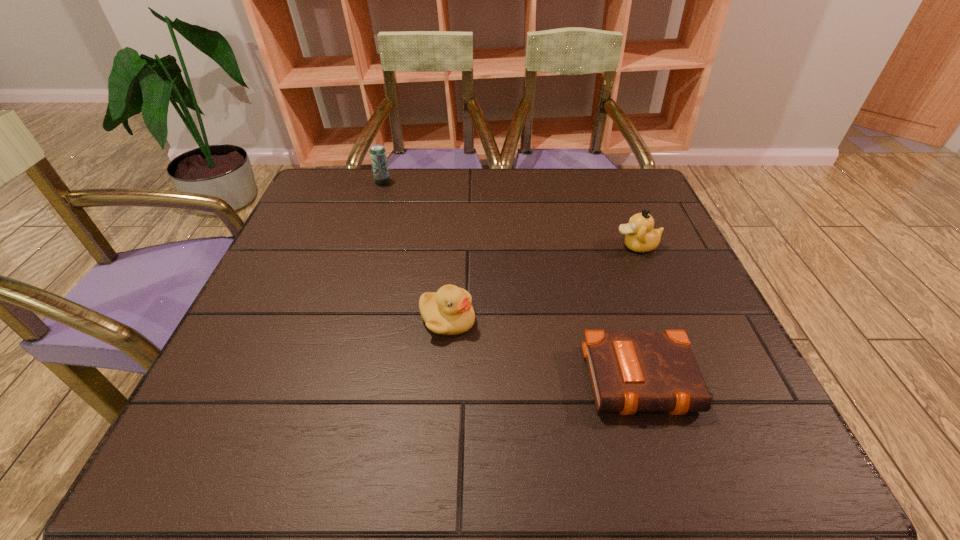
Where is `free region at the left edge`? free region at the left edge is located at coordinates (321, 217).

Where is `blank area at the right edge`? The image size is (960, 540). blank area at the right edge is located at coordinates (688, 307).

This screenshot has height=540, width=960. In the image, there is a desktop. Find the location of `vacant space at the far left corner`. vacant space at the far left corner is located at coordinates (330, 193).

The height and width of the screenshot is (540, 960). Find the location of `vacant space at the near left corner`. vacant space at the near left corner is located at coordinates (279, 434).

Image resolution: width=960 pixels, height=540 pixels. In the image, there is a desktop. Find the location of `blank space at the far right corner`. blank space at the far right corner is located at coordinates (610, 205).

In the image, there is a desktop. At what (x,y) coordinates should I click in order to perform the action: click on blank space at the near right corner. Please return your answer as a coordinate pair (x, y). This screenshot has width=960, height=540. Looking at the image, I should click on (691, 470).

The width and height of the screenshot is (960, 540). Find the location of `empty space that is in between the farthest object and the nearer duckling`. empty space that is in between the farthest object and the nearer duckling is located at coordinates (415, 252).

This screenshot has width=960, height=540. What are the coordinates of `unoccupied position between the beer can and the farther duckling` in the screenshot? It's located at (510, 214).

What are the coordinates of `free space between the second nearest object and the beer can` in the screenshot? It's located at (415, 252).

The height and width of the screenshot is (540, 960). Identify the location of vacant area that lies between the second farthest object and the Bible. (640, 313).